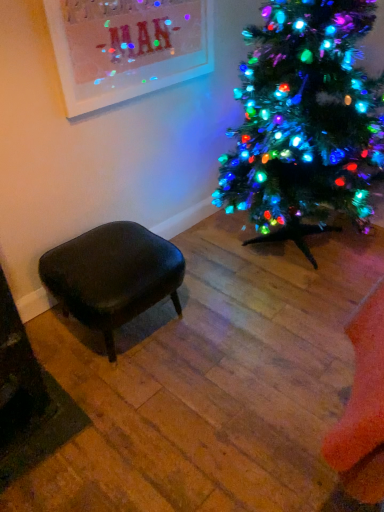
I want to click on black leather stool at lower left, so click(x=112, y=276).

Measure the distance between point (x=101, y=280) and camera.

The depth of point (x=101, y=280) is 1.48 meters.

Describe the element at coordinates (112, 276) in the screenshot. I see `black leather stool at lower left` at that location.

Find the location of `black leather stool at lower left`. black leather stool at lower left is located at coordinates (112, 276).